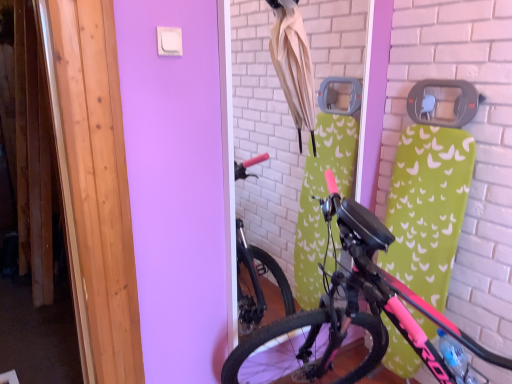
In order to face pink matte bicycle at center, should I rotate leftwards or rightwards?

It's best to rotate right around 18.782 degrees.

The width and height of the screenshot is (512, 384). I want to click on pink matte bicycle at center, so click(x=348, y=316).

The width and height of the screenshot is (512, 384). What do you see at coordinates (348, 316) in the screenshot?
I see `pink matte bicycle at center` at bounding box center [348, 316].

What do you see at coordinates (293, 64) in the screenshot? I see `beige fabric umbrella at upper center` at bounding box center [293, 64].

The width and height of the screenshot is (512, 384). Identify the location of beige fabric umbrella at upper center. (293, 64).

Consider the image. Measure the distance between point (285,74) and camera.

The depth of point (285,74) is 5.19 feet.

Locate an element on the screen. The image size is (512, 384). pink matte bicycle at center is located at coordinates (348, 316).

Between beige fabric umbrella at upper center and pink matte bicycle at center, which one appears on the left side from the viewer's perspective?

From the viewer's perspective, beige fabric umbrella at upper center appears more on the left side.

Is beige fabric umbrella at upper center further to camera compared to pink matte bicycle at center?

That is True.

Which is in front, point (306, 90) or point (258, 362)?

Positioned in front is point (306, 90).

From the image's perspective, between beige fabric umbrella at upper center and pink matte bicycle at center, who is located below?

pink matte bicycle at center appears lower in the image.

From a real-world perspective, which is physically below, beige fabric umbrella at upper center or pink matte bicycle at center?

pink matte bicycle at center, from a real-world perspective.

In the scene shown: Considering the relative sizes of beige fabric umbrella at upper center and pink matte bicycle at center in the image provided, is beige fabric umbrella at upper center thinner than pink matte bicycle at center?

Yes, beige fabric umbrella at upper center is thinner than pink matte bicycle at center.

Is beige fabric umbrella at upper center taller or shorter than pink matte bicycle at center?

Clearly, beige fabric umbrella at upper center is shorter compared to pink matte bicycle at center.

Based on the photo, is beige fabric umbrella at upper center bigger than pink matte bicycle at center?

Incorrect, beige fabric umbrella at upper center is not larger than pink matte bicycle at center.

Which is correct: beige fabric umbrella at upper center is inside pink matte bicycle at center, or outside of it?

beige fabric umbrella at upper center is not enclosed by pink matte bicycle at center.

Is beige fabric umbrella at upper center far away from pink matte bicycle at center?

beige fabric umbrella at upper center is near pink matte bicycle at center, not far away.

Based on the photo, could you tell me if beige fabric umbrella at upper center is facing pink matte bicycle at center?

No, beige fabric umbrella at upper center is not oriented towards pink matte bicycle at center.

How much distance is there between beige fabric umbrella at upper center and pink matte bicycle at center?

beige fabric umbrella at upper center is 28.99 inches away from pink matte bicycle at center.

The image size is (512, 384). I want to click on bicycle below the beige fabric umbrella at upper center (from a real-world perspective), so click(x=348, y=316).

Considering the relative positions of pink matte bicycle at center and beige fabric umbrella at upper center in the image provided, is pink matte bicycle at center to the left of beige fabric umbrella at upper center from the viewer's perspective?

Incorrect, pink matte bicycle at center is not on the left side of beige fabric umbrella at upper center.

Is pink matte bicycle at center positioned behind beige fabric umbrella at upper center?

No.

Is point (362, 291) more distant than point (309, 98)?

No, it is not.

From the image's perspective, is pink matte bicycle at center located above beige fabric umbrella at upper center?

Incorrect, from the image's perspective, pink matte bicycle at center is lower than beige fabric umbrella at upper center.

From a real-world perspective, does pink matte bicycle at center stand above beige fabric umbrella at upper center?

No.

Looking at their sizes, would you say pink matte bicycle at center is wider or thinner than beige fabric umbrella at upper center?

pink matte bicycle at center is wider than beige fabric umbrella at upper center.

Which of these two, pink matte bicycle at center or beige fabric umbrella at upper center, stands taller?

With more height is pink matte bicycle at center.

Which of these two, pink matte bicycle at center or beige fabric umbrella at upper center, is smaller?

beige fabric umbrella at upper center.

Is pink matte bicycle at center surrounding beige fabric umbrella at upper center?

No.

Is pink matte bicycle at center not close to beige fabric umbrella at upper center?

No, there isn't a large distance between pink matte bicycle at center and beige fabric umbrella at upper center.

Is pink matte bicycle at center oriented away from beige fabric umbrella at upper center?

pink matte bicycle at center is not turned away from beige fabric umbrella at upper center.

I want to click on umbrella on the left of pink matte bicycle at center, so click(x=293, y=64).

The image size is (512, 384). Identify the location of umbrella that is on the left side of pink matte bicycle at center. (293, 64).

In order to click on umbrella behind the pink matte bicycle at center in this screenshot , I will do `click(293, 64)`.